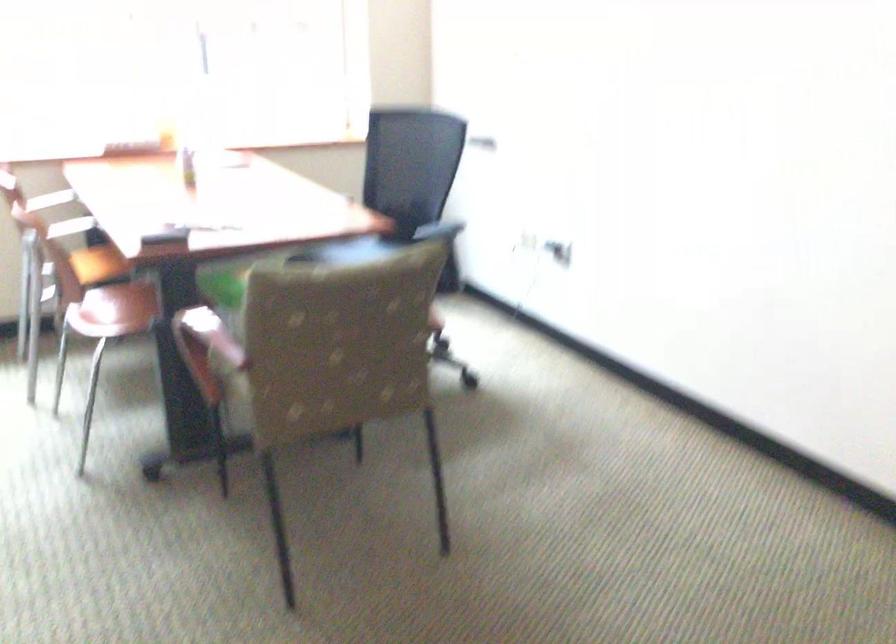
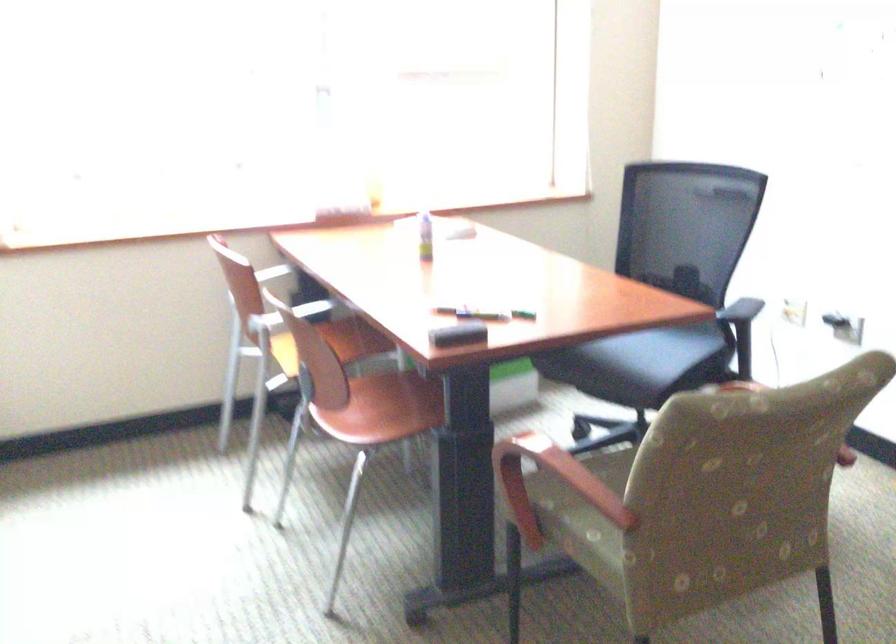
Locate, in the second image, the point that corresponds to pixel 192 158 in the first image.

(425, 236)